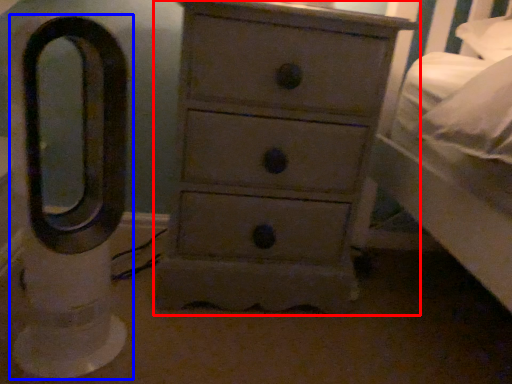
Question: Which object appears farthest to the camera in this image, chest of drawers (highlighted by a red box) or swivel chair (highlighted by a blue box)?

Choices:
 (A) chest of drawers
 (B) swivel chair

Answer: (A)